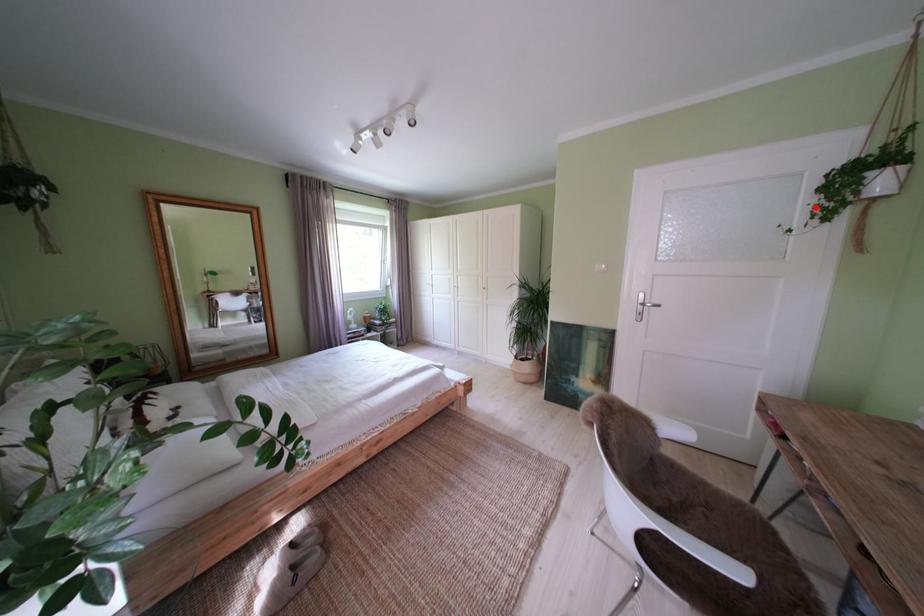
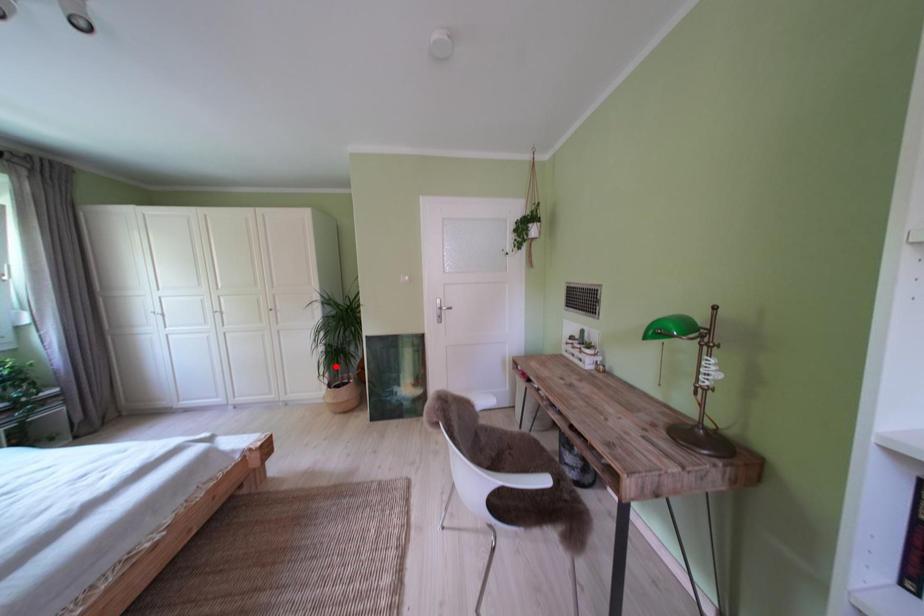
I am providing you with two images of the same scene from different viewpoints. A red point is marked on the first image and another point is marked on the second image. Are the points marked in image1 and image2 representing the same 3D position?

No